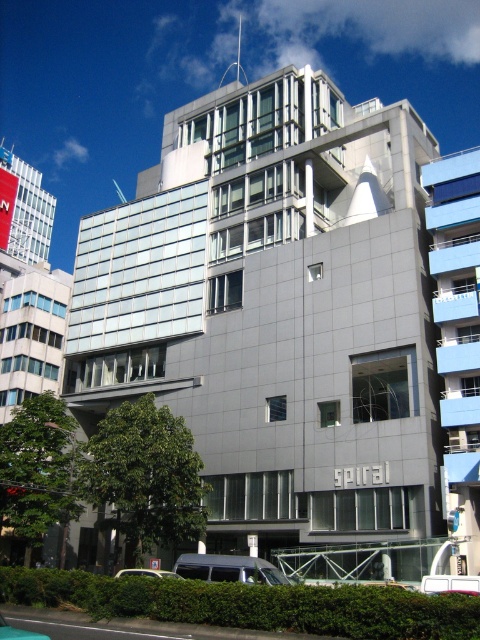
In the scene shown: You are a delivery driver needing to park your 15 feet long truck between the metallic silver van at lower left and the white matte van at lower center. Can you fit your truck in the space between them without overlapping either vehicle?

The space between the metallic silver van at lower left and the white matte van at lower center is 47.74 feet. Since your truck is only 15 feet long, there is sufficient space to park your truck between them without overlapping either vehicle.

You are a delivery driver who needs to park your silver metallic van at center and metallic silver van at lower left in the parking lot. Which van should you park first to fit both vehicles in the space?

The silver metallic van at center is larger in size than metallic silver silver van at lower left, so you should park the larger van first to ensure both fit in the space.

You are a delivery driver who needs to park your vehicle in the parking lot near the SPIRAL building. You have two options for parking spots next to the silver metallic van at center and the white matte van at lower center. Which van is shorter so that you can choose the spot next to it without worrying about height restrictions?

The silver metallic van at center is not as tall as the white matte van at lower center, so the silver metallic van at center is shorter. Therefore, you should choose the parking spot next to the silver metallic van at center to avoid height restrictions.